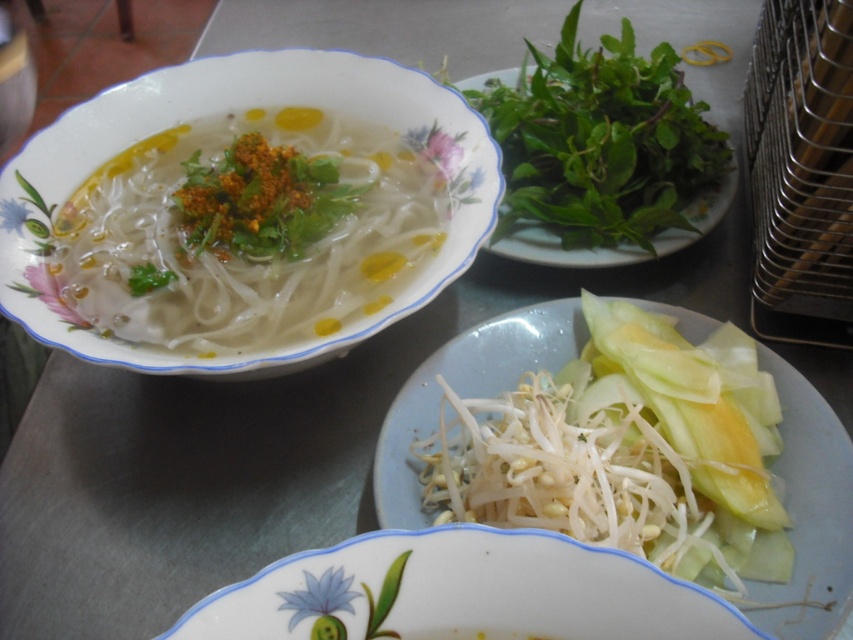
You are a food critic analyzing the arrangement of the meal setup. Which item is positioned higher up in the image between the green leafy at upper right and the white translucent noodles at lower center?

The green leafy at upper right is positioned higher up in the image compared to the white translucent noodles at lower center.

You are a food critic who needs to describe the arrangement of the two white items on the plate. How far apart are the white translucent bean sprouts at lower center and the white translucent noodles at lower center?

The white translucent bean sprouts at lower center and the white translucent noodles at lower center are 0.68 inches apart.